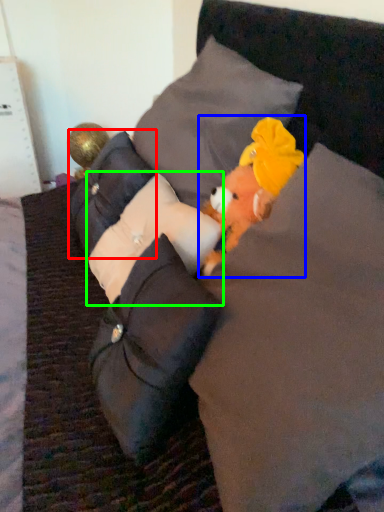
Question: Estimate the real-world distances between objects in this image. Which object is closer to pillow (highlighted by a red box), toy (highlighted by a blue box) or pillow (highlighted by a green box)?

Choices:
 (A) toy
 (B) pillow

Answer: (B)